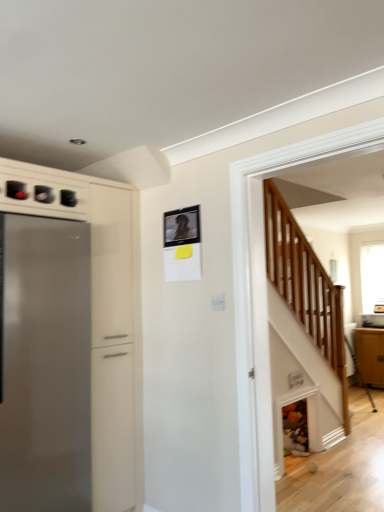
What is the approximate width of matte black picture frame at upper center?

It is 0.84 inches.

Measure the distance between point [163,224] and camera.

Point [163,224] and camera are 2.53 meters apart from each other.

Identify the location of clear glass window at upper right. (372, 277).

Is point (8, 358) closer or farther from the camera than point (198, 221)?

Point (8, 358).

Is satin silver refrigerator at left placed right next to matte black picture frame at upper center?

satin silver refrigerator at left is not next to matte black picture frame at upper center, and they're not touching.

Do you think satin silver refrigerator at left is within matte black picture frame at upper center, or outside of it?

satin silver refrigerator at left cannot be found inside matte black picture frame at upper center.

Is satin silver refrigerator at left a part of matte brown cabinet at right?

No, satin silver refrigerator at left is not a part of matte brown cabinet at right.

In terms of width, does matte brown cabinet at right look wider or thinner when compared to satin silver refrigerator at left?

Clearly, matte brown cabinet at right has less width compared to satin silver refrigerator at left.

Consider the image. Is matte brown cabinet at right taller than satin silver refrigerator at left?

No.

Which is behind, matte brown cabinet at right or satin silver refrigerator at left?

matte brown cabinet at right is further from the camera.

Considering the sizes of objects matte black picture frame at upper center and matte brown cabinet at right in the image provided, who is smaller, matte black picture frame at upper center or matte brown cabinet at right?

Smaller between the two is matte black picture frame at upper center.

Is matte black picture frame at upper center looking in the opposite direction of matte brown cabinet at right?

Yes, matte brown cabinet at right is at the back of matte black picture frame at upper center.

Considering the relative sizes of matte black picture frame at upper center and matte brown cabinet at right in the image provided, is matte black picture frame at upper center wider than matte brown cabinet at right?

No, matte black picture frame at upper center is not wider than matte brown cabinet at right.

From a real-world perspective, is matte black picture frame at upper center positioned under matte brown cabinet at right based on gravity?

Incorrect, from a real-world perspective, matte black picture frame at upper center is higher than matte brown cabinet at right.

Who is more distant, satin silver refrigerator at left or matte brown cabinet at right?

Positioned behind is matte brown cabinet at right.

Are satin silver refrigerator at left and matte brown cabinet at right located far from each other?

Yes, satin silver refrigerator at left and matte brown cabinet at right are located far from each other.

From the image's perspective, who appears lower, satin silver refrigerator at left or matte brown cabinet at right?

From the image's view, matte brown cabinet at right is below.

Find the location of a particular element. The height and width of the screenshot is (512, 384). cabinetry behind the satin silver refrigerator at left is located at coordinates (370, 354).

From a real-world perspective, is clear glass window at upper right positioned above or below satin silver refrigerator at left?

In terms of real-world spatial position, clear glass window at upper right is above satin silver refrigerator at left.

Is clear glass window at upper right not close to satin silver refrigerator at left?

Yes.

Does point (376, 279) come in front of point (83, 472)?

That is False.

Is matte brown cabinet at right not close to clear glass window at upper right?

No, matte brown cabinet at right is in close proximity to clear glass window at upper right.

Considering the relative sizes of matte brown cabinet at right and clear glass window at upper right in the image provided, is matte brown cabinet at right taller than clear glass window at upper right?

Incorrect, the height of matte brown cabinet at right is not larger of that of clear glass window at upper right.

Is matte brown cabinet at right facing away from clear glass window at upper right?

matte brown cabinet at right is not turned away from clear glass window at upper right.

Can you confirm if matte brown cabinet at right is smaller than clear glass window at upper right?

Actually, matte brown cabinet at right might be larger than clear glass window at upper right.

From the image's perspective, which is above, clear glass window at upper right or matte black picture frame at upper center?

From the image's view, matte black picture frame at upper center is above.

Is matte black picture frame at upper center surrounded by clear glass window at upper right?

Actually, matte black picture frame at upper center is outside clear glass window at upper right.

From a real-world perspective, who is located lower, clear glass window at upper right or matte black picture frame at upper center?

In real-world perspective, clear glass window at upper right is lower.

Which object is thinner, clear glass window at upper right or matte black picture frame at upper center?

matte black picture frame at upper center.

The width and height of the screenshot is (384, 512). Find the location of `refrigerator that is in front of the matte black picture frame at upper center`. refrigerator that is in front of the matte black picture frame at upper center is located at coordinates (44, 364).

This screenshot has width=384, height=512. In order to click on cabinetry on the right of satin silver refrigerator at left in this screenshot , I will do `click(370, 354)`.

Based on their spatial positions, is matte black picture frame at upper center or matte brown cabinet at right closer to satin silver refrigerator at left?

matte black picture frame at upper center is closer to satin silver refrigerator at left.

Estimate the real-world distances between objects in this image. Which object is further from satin silver refrigerator at left, matte brown cabinet at right or matte black picture frame at upper center?

matte brown cabinet at right.

From the image, which object appears to be farther from satin silver refrigerator at left, clear glass window at upper right or matte black picture frame at upper center?

The object further to satin silver refrigerator at left is clear glass window at upper right.

Considering their positions, is matte black picture frame at upper center positioned closer to clear glass window at upper right than matte brown cabinet at right?

matte brown cabinet at right lies closer to clear glass window at upper right than the other object.

Which object lies nearer to the anchor point clear glass window at upper right, matte black picture frame at upper center or satin silver refrigerator at left?

matte black picture frame at upper center.

From the picture: Looking at the image, which one is located closer to satin silver refrigerator at left, clear glass window at upper right or matte brown cabinet at right?

matte brown cabinet at right is closer to satin silver refrigerator at left.

When comparing their distances from matte brown cabinet at right, does clear glass window at upper right or matte black picture frame at upper center seem closer?

Among the two, clear glass window at upper right is located nearer to matte brown cabinet at right.

Which object lies nearer to the anchor point matte black picture frame at upper center, clear glass window at upper right or matte brown cabinet at right?

matte brown cabinet at right.

The image size is (384, 512). I want to click on cabinetry between matte black picture frame at upper center and clear glass window at upper right in the front-back direction, so click(370, 354).

Where is `picture frame between satin silver refrigerator at left and clear glass window at upper right along the z-axis`? This screenshot has height=512, width=384. picture frame between satin silver refrigerator at left and clear glass window at upper right along the z-axis is located at coordinates (181, 226).

Identify the location of cabinetry between satin silver refrigerator at left and clear glass window at upper right from front to back. This screenshot has height=512, width=384. (370, 354).

I want to click on picture frame between satin silver refrigerator at left and matte brown cabinet at right along the z-axis, so click(181, 226).